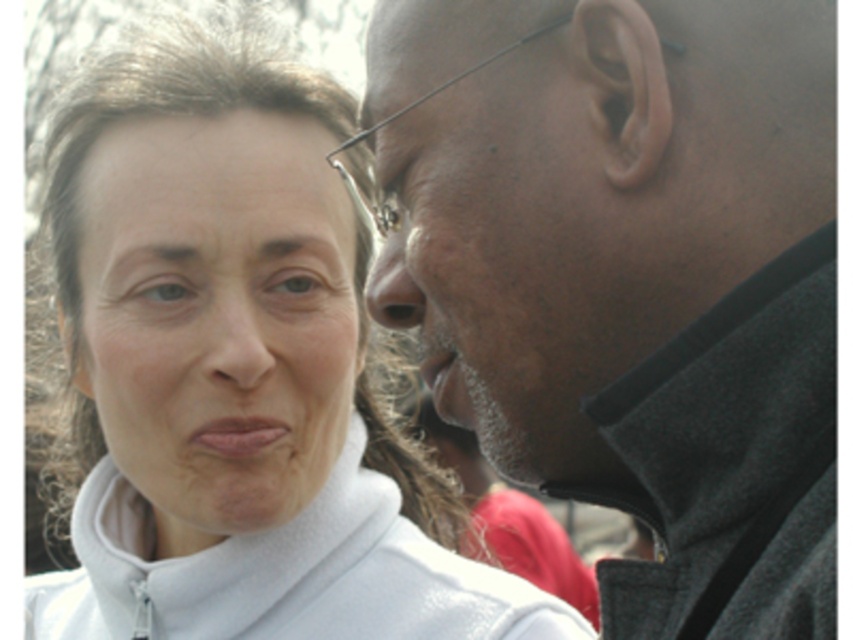
Which is above, white matte jacket at center or white matte face at upper left?

A: white matte face at upper left

Does white matte jacket at center have a greater width compared to white matte face at upper left?

Indeed, white matte jacket at center has a greater width compared to white matte face at upper left.

Does point (163, 580) come closer to viewer compared to point (318, 134)?

That is True.

You are a GUI agent. You are given a task and a screenshot of the screen. Output one action in this format:
    pyautogui.click(x=<x>, y=<y>)
    Task: Click on the white matte jacket at center
    
    Given the screenshot: What is the action you would take?
    pyautogui.click(x=235, y=396)

Does white matte jacket at center appear over matte skin nose at center?

No.

Is white matte jacket at center wider than matte skin nose at center?

Yes, white matte jacket at center is wider than matte skin nose at center.

Locate an element on the screen. This screenshot has width=853, height=640. white matte jacket at center is located at coordinates (235, 396).

Find the location of `white matte jacket at center`. white matte jacket at center is located at coordinates (235, 396).

Can you confirm if gray fleece jacket at right is positioned above white matte jacket at center?

Yes.

At what (x,y) coordinates should I click in order to perform the action: click on gray fleece jacket at right. Please return your answer as a coordinate pair (x, y). The width and height of the screenshot is (853, 640). Looking at the image, I should click on (634, 275).